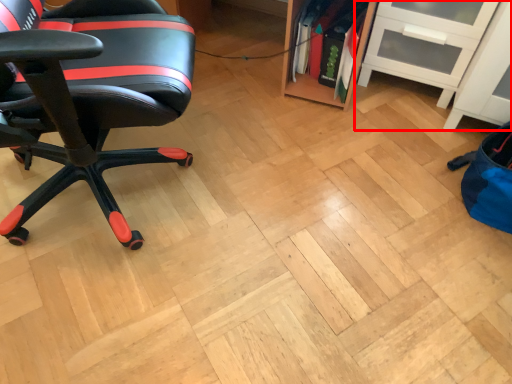
Question: From the image, what is the correct spatial relationship of shelf (annotated by the red box) in relation to chair?

Choices:
 (A) left
 (B) right

Answer: (B)